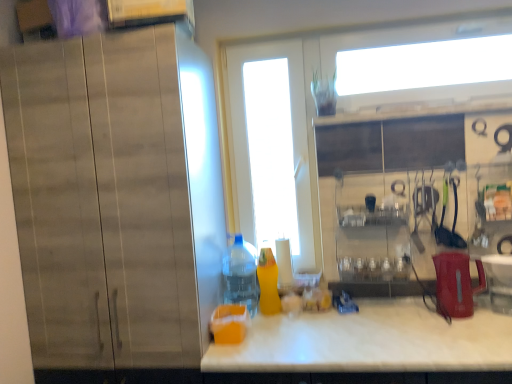
I want to click on vacant area that is in front of translucent plastic bottle at center, which is counted as the 1th bottle, starting from the left, so click(x=262, y=326).